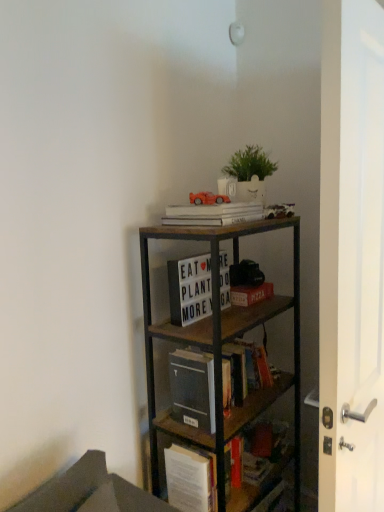
Image resolution: width=384 pixels, height=512 pixels. Find the location of `wooden bookcase at upper right`. wooden bookcase at upper right is located at coordinates (216, 325).

How much space does matte cardboard book at center, the third book when ordered from top to bottom, occupy horizontally?

5.66 inches.

The width and height of the screenshot is (384, 512). What do you see at coordinates (250, 294) in the screenshot? I see `matte cardboard book at center, the third book when ordered from top to bottom` at bounding box center [250, 294].

Describe the element at coordinates (248, 174) in the screenshot. Image resolution: width=384 pixels, height=512 pixels. I see `white matte planter at upper center` at that location.

The height and width of the screenshot is (512, 384). I want to click on white glossy door at right, so click(x=351, y=255).

The image size is (384, 512). In order to click on wooden bookcase at upper right in this screenshot , I will do `click(216, 325)`.

From a real-world perspective, is white matte book at upper center, which ranks as the first book in top-to-bottom order, on wooden bookcase at upper right?

Yes, from a real-world perspective, white matte book at upper center, which ranks as the first book in top-to-bottom order, is on top of wooden bookcase at upper right.

Is white matte book at upper center, which ranks as the first book in top-to-bottom order, bigger or smaller than wooden bookcase at upper right?

Clearly, white matte book at upper center, which ranks as the first book in top-to-bottom order, is smaller in size than wooden bookcase at upper right.

From the image's perspective, which one is positioned higher, white matte book at upper center, which ranks as the first book in top-to-bottom order, or wooden bookcase at upper right?

white matte book at upper center, which ranks as the first book in top-to-bottom order.

Does point (200, 211) lie behind point (299, 464)?

No, it is in front of (299, 464).

Who is bigger, white matte planter at upper center or wooden bookcase at upper right?

Bigger between the two is wooden bookcase at upper right.

Is white matte planter at upper center spatially inside wooden bookcase at upper right, or outside of it?

white matte planter at upper center lies outside wooden bookcase at upper right.

Is point (260, 186) closer or farther from the camera than point (296, 504)?

Point (260, 186) appears to be closer to the viewer than point (296, 504).

Which of these two, white matte planter at upper center or wooden bookcase at upper right, stands taller?

wooden bookcase at upper right.

Is matte cardboard book at center, which is the 2th book from bottom to top, looking in the opposite direction of white matte letter board at center, which is counted as the third book, starting from the bottom?

That's not correct — matte cardboard book at center, which is the 2th book from bottom to top, is not looking away from white matte letter board at center, which is counted as the third book, starting from the bottom.

From the image's perspective, which object appears higher, matte cardboard book at center, the third book when ordered from top to bottom, or white matte letter board at center, which is counted as the third book, starting from the bottom?

From the image's view, white matte letter board at center, which is counted as the third book, starting from the bottom, is above.

Is matte cardboard book at center, which is the 2th book from bottom to top, directly adjacent to white matte letter board at center, arranged as the 2th book when viewed from the top?

matte cardboard book at center, which is the 2th book from bottom to top, and white matte letter board at center, arranged as the 2th book when viewed from the top, are not in contact.

Can white matte book at upper center, which ranks as the first book in top-to-bottom order, be found inside wooden bookcase at upper right?

Definitely not — white matte book at upper center, which ranks as the first book in top-to-bottom order, is not inside wooden bookcase at upper right.

Could you measure the distance between wooden bookcase at upper right and white matte book at upper center, the fourth book positioned from the bottom?

A distance of 7.10 inches exists between wooden bookcase at upper right and white matte book at upper center, the fourth book positioned from the bottom.

Is point (251, 226) closer or farther from the camera than point (185, 214)?

Clearly, point (251, 226) is closer to the camera than point (185, 214).

Is matte cardboard book at center, which is the 2th book from bottom to top, oriented towards white glossy door at right?

Yes, matte cardboard book at center, which is the 2th book from bottom to top, is turned towards white glossy door at right.

Is matte cardboard book at center, the third book when ordered from top to bottom, placed right next to white glossy door at right?

No, matte cardboard book at center, the third book when ordered from top to bottom, is not in contact with white glossy door at right.

Looking at their sizes, would you say matte cardboard book at center, the third book when ordered from top to bottom, is wider or thinner than white glossy door at right?

matte cardboard book at center, the third book when ordered from top to bottom, is wider than white glossy door at right.

In the scene shown: Which object is positioned more to the right, matte cardboard book at center, which is the 2th book from bottom to top, or white glossy door at right?

From the viewer's perspective, white glossy door at right appears more on the right side.

From a real-world perspective, which is physically below, wooden book at center, which ranks as the 4th book in top-to-bottom order, or matte cardboard book at center, which is the 2th book from bottom to top?

From a 3D spatial view, wooden book at center, which ranks as the 4th book in top-to-bottom order, is below.

Is wooden book at center, placed as the first book when sorted from bottom to top, taller or shorter than matte cardboard book at center, the third book when ordered from top to bottom?

Considering their sizes, wooden book at center, placed as the first book when sorted from bottom to top, has more height than matte cardboard book at center, the third book when ordered from top to bottom.

Does wooden book at center, placed as the first book when sorted from bottom to top, turn towards matte cardboard book at center, the third book when ordered from top to bottom?

No, wooden book at center, placed as the first book when sorted from bottom to top, is not oriented towards matte cardboard book at center, the third book when ordered from top to bottom.

How different are the orientations of wooden book at center, which ranks as the 4th book in top-to-bottom order, and matte cardboard book at center, which is the 2th book from bottom to top, in degrees?

2.92 degrees.

Based on their positions, is white matte book at upper center, the fourth book positioned from the bottom, located to the left or right of white glossy door at right?

In the image, white matte book at upper center, the fourth book positioned from the bottom, appears on the left side of white glossy door at right.

Is white matte book at upper center, the fourth book positioned from the bottom, in front of or behind white glossy door at right in the image?

Visually, white matte book at upper center, the fourth book positioned from the bottom, is located behind white glossy door at right.

Is white matte book at upper center, which ranks as the first book in top-to-bottom order, taller than white glossy door at right?

No, white matte book at upper center, which ranks as the first book in top-to-bottom order, is not taller than white glossy door at right.

What are the coordinates of `bookcase below the white matte book at upper center, the fourth book positioned from the bottom (from a real-world perspective)` in the screenshot? It's located at (216, 325).

The height and width of the screenshot is (512, 384). What are the coordinates of `bookcase that appears below the white matte planter at upper center (from the image's perspective)` in the screenshot? It's located at (216, 325).

Which object lies nearer to the anchor point matte cardboard book at center, which is the 2th book from bottom to top, wooden book at center, placed as the first book when sorted from bottom to top, or white matte letter board at center, which is counted as the third book, starting from the bottom?

white matte letter board at center, which is counted as the third book, starting from the bottom, is closer to matte cardboard book at center, which is the 2th book from bottom to top.

From the image, which object appears to be nearer to white matte planter at upper center, white glossy door at right or matte cardboard book at center, which is the 2th book from bottom to top?

Based on the image, matte cardboard book at center, which is the 2th book from bottom to top, appears to be nearer to white matte planter at upper center.

From the image, which object appears to be nearer to white matte book at upper center, the fourth book positioned from the bottom, matte cardboard book at center, which is the 2th book from bottom to top, or white matte planter at upper center?

white matte planter at upper center.

Based on the photo, from the image, which object appears to be farther from white matte book at upper center, the fourth book positioned from the bottom, white matte letter board at center, which is counted as the third book, starting from the bottom, or matte cardboard book at center, the third book when ordered from top to bottom?

matte cardboard book at center, the third book when ordered from top to bottom, is positioned further to the anchor white matte book at upper center, the fourth book positioned from the bottom.

Which object lies further to the anchor point white glossy door at right, wooden book at center, which ranks as the 4th book in top-to-bottom order, or matte cardboard book at center, the third book when ordered from top to bottom?

The object further to white glossy door at right is matte cardboard book at center, the third book when ordered from top to bottom.

Estimate the real-world distances between objects in this image. Which object is closer to wooden bookcase at upper right, white glossy door at right or white matte planter at upper center?

white matte planter at upper center is positioned closer to the anchor wooden bookcase at upper right.

Considering their positions, is white matte planter at upper center positioned further to matte cardboard book at center, the third book when ordered from top to bottom, than white matte book at upper center, the fourth book positioned from the bottom?

white matte planter at upper center is positioned further to the anchor matte cardboard book at center, the third book when ordered from top to bottom.

Which object lies nearer to the anchor point wooden book at center, placed as the first book when sorted from bottom to top, white matte planter at upper center or wooden bookcase at upper right?

wooden bookcase at upper right lies closer to wooden book at center, placed as the first book when sorted from bottom to top, than the other object.

The height and width of the screenshot is (512, 384). Identify the location of book between white matte planter at upper center and white matte letter board at center, which is counted as the third book, starting from the bottom, in the up-down direction. (213, 214).

Where is `bookcase between white glossy door at right and wooden book at center, which ranks as the 4th book in top-to-bottom order, along the z-axis`? This screenshot has width=384, height=512. bookcase between white glossy door at right and wooden book at center, which ranks as the 4th book in top-to-bottom order, along the z-axis is located at coordinates (216, 325).

Locate an element on the screen. glass door that lies between white matte planter at upper center and wooden bookcase at upper right from top to bottom is located at coordinates (351, 255).

Find the location of a particular element. bookcase between white glossy door at right and matte cardboard book at center, which is the 2th book from bottom to top, along the z-axis is located at coordinates (216, 325).